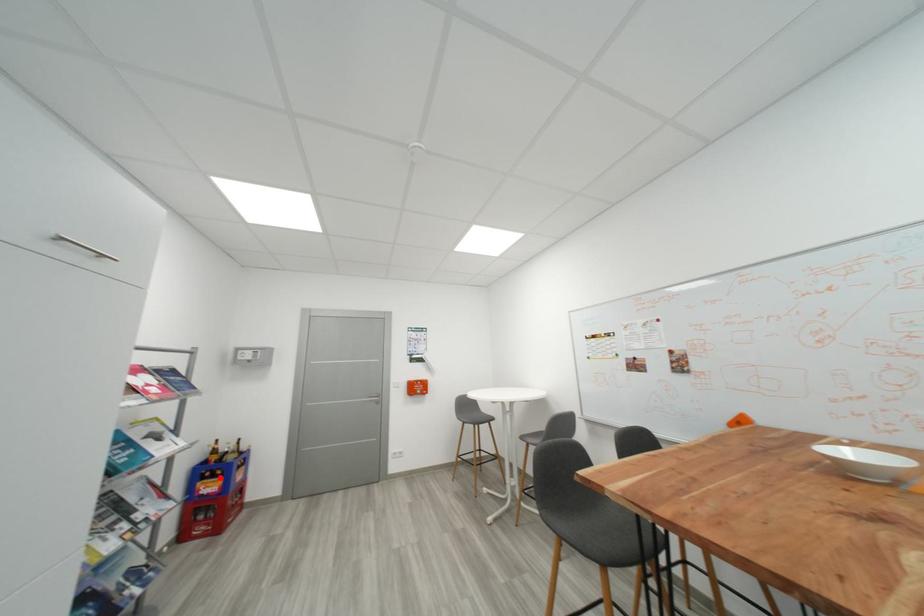
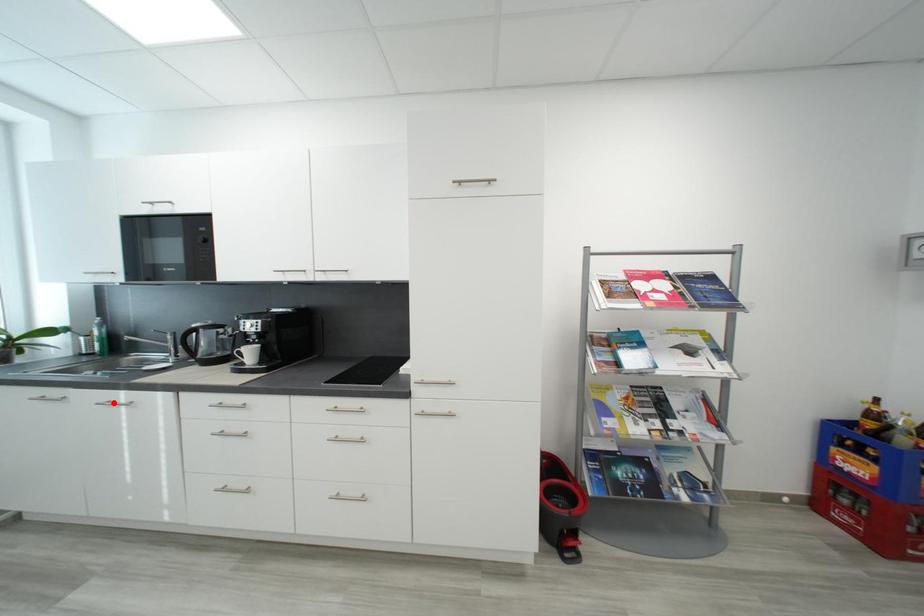
I am providing you with two images of the same scene from different viewpoints. A red point is marked on the first image and another point is marked on the second image. Is the marked point in image1 the same physical position as the marked point in image2?

No